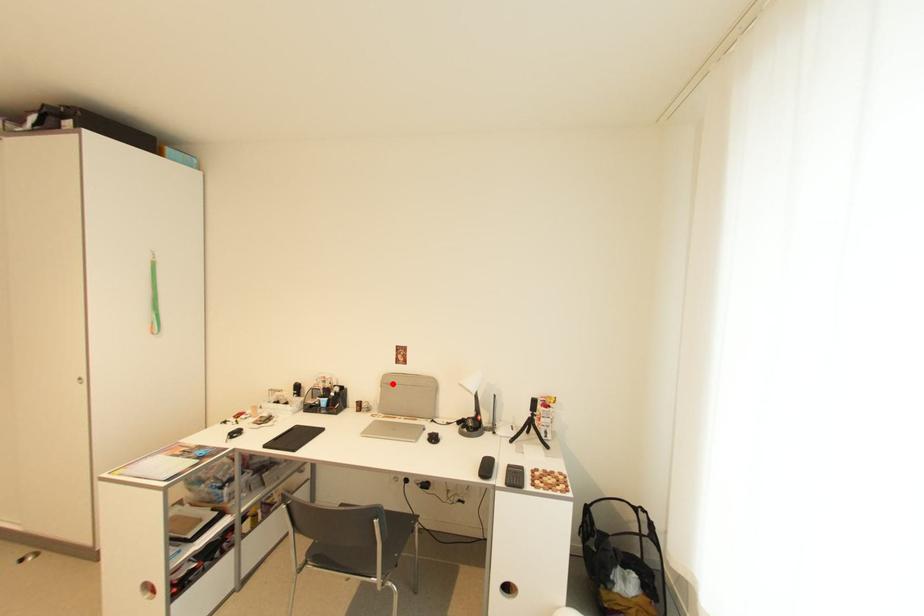
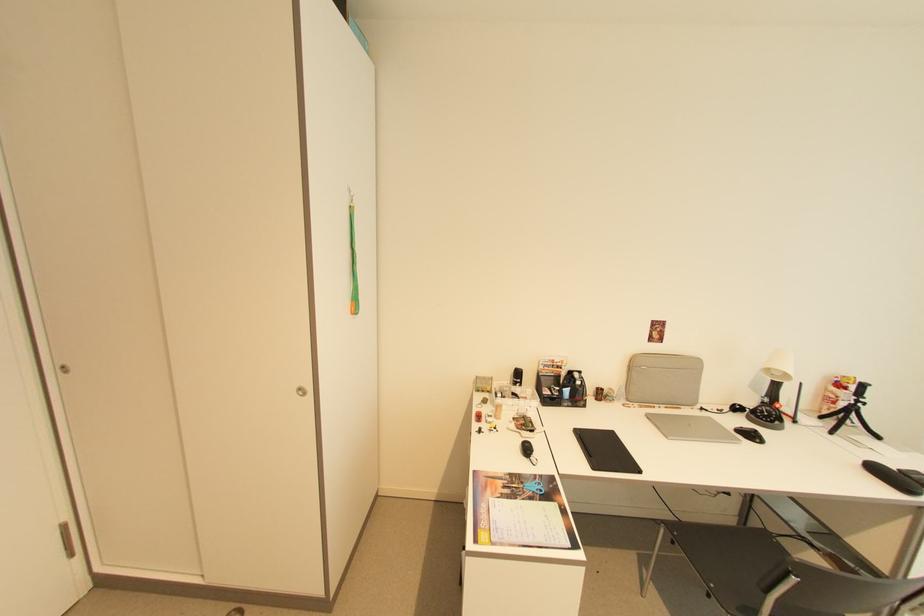
In the second image, find the point that corresponds to the highlighted location in the first image.

(638, 366)